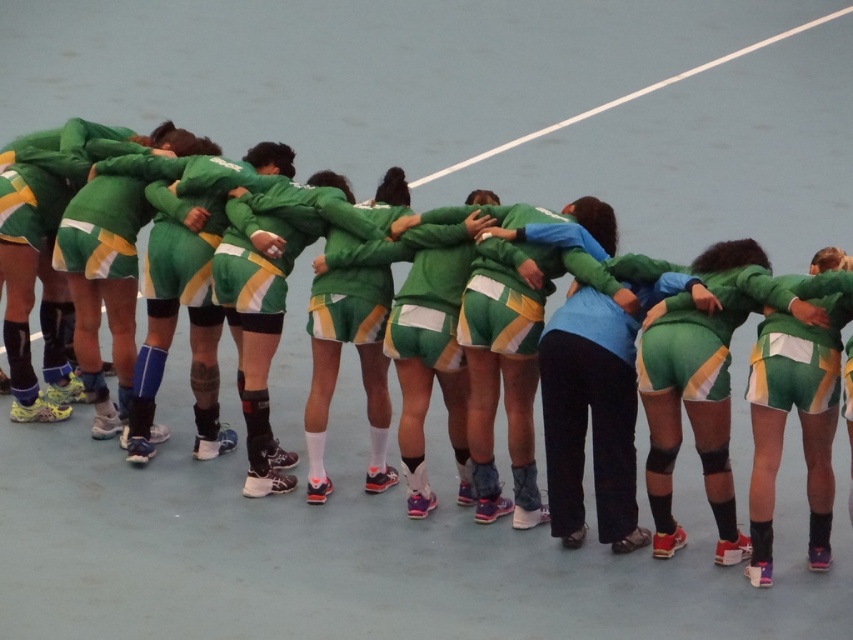
You are standing at the point marked as point (824, 368) in the image. You want to walk to the nearest exit of the sports court. The nearest exit is located 10 meters away from you. Can you reach the exit without walking more than 10 meters?

The distance between you and the viewer is 8.14 meters, which is less than 10 meters, so yes, you can reach the exit without exceeding the distance limit.

Based on the photo, you are a photographer standing at the back of the indoor sports court. You want to take a photo of the green jersey at center so that it appears above the white line at upper center in the final image. Is this possible based on their current positions?

The green jersey at center is positioned under the white line at upper center, so to make it appear above in the photo, the photographer would need to adjust the camera angle or the subjects position since their current arrangement places the green jersey below the white line.

You are a photographer positioned at the back of the court. You want to take a photo of the team huddle but need to ensure both the green matte jersey at center and the green jersey at center are visible. Which one should you adjust your angle to focus on first?

The green matte jersey at center is located above the green jersey at center, so you should focus on the green matte jersey at center first to ensure both are visible in the photo.